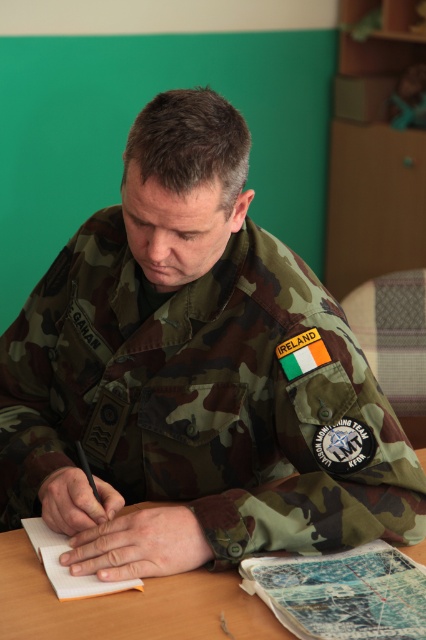
Between wooden table at center and white paper notebook at center, which one is positioned lower?

wooden table at center is lower down.

Is wooden table at center further to camera compared to white paper notebook at center?

No, wooden table at center is closer to the viewer.

Who is more distant from viewer, (157, 611) or (48, 556)?

The point (48, 556) is behind.

Locate an element on the screen. The image size is (426, 640). wooden table at center is located at coordinates (127, 605).

In the scene shown: Who is positioned more to the right, wooden table at center or white paper notebook at lower center?

white paper notebook at lower center

Measure the distance between point (236,586) and camera.

Point (236,586) is 3.46 feet away from camera.

Which is in front, point (213, 593) or point (325, 625)?

Point (325, 625) is in front.

The image size is (426, 640). I want to click on wooden table at center, so click(x=127, y=605).

Who is shorter, white paper notebook at lower center or white paper notebook at center?

white paper notebook at center

Who is lower down, white paper notebook at lower center or white paper notebook at center?

white paper notebook at lower center

Does point (336, 586) lie behind point (51, 563)?

That is False.

Find the location of a particular element. Image resolution: width=426 pixels, height=640 pixels. white paper notebook at lower center is located at coordinates (342, 593).